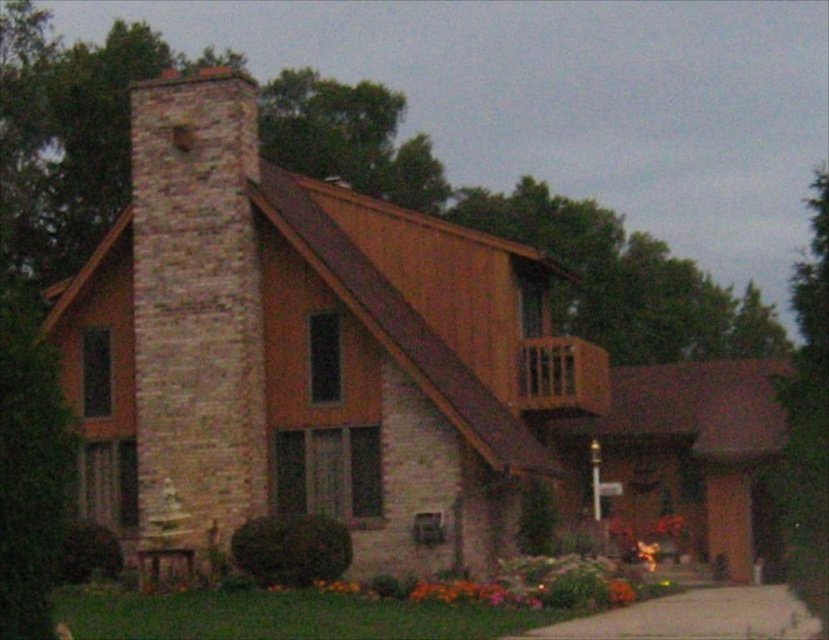
You are standing at the center of the image. Which direction should you move to reach the brick chimney at left?

→ Since the brick chimney at left is located at point 0.491 on the x axis and 0.238 on the y axis, you should move to the left to reach it.

You are a painter standing at the front yard of the house. You need to paint both the brick chimney at left and the green grass at lower center. Which object will require more paint due to its size?

The brick chimney at left is bigger than the green grass at lower center, so it will require more paint.